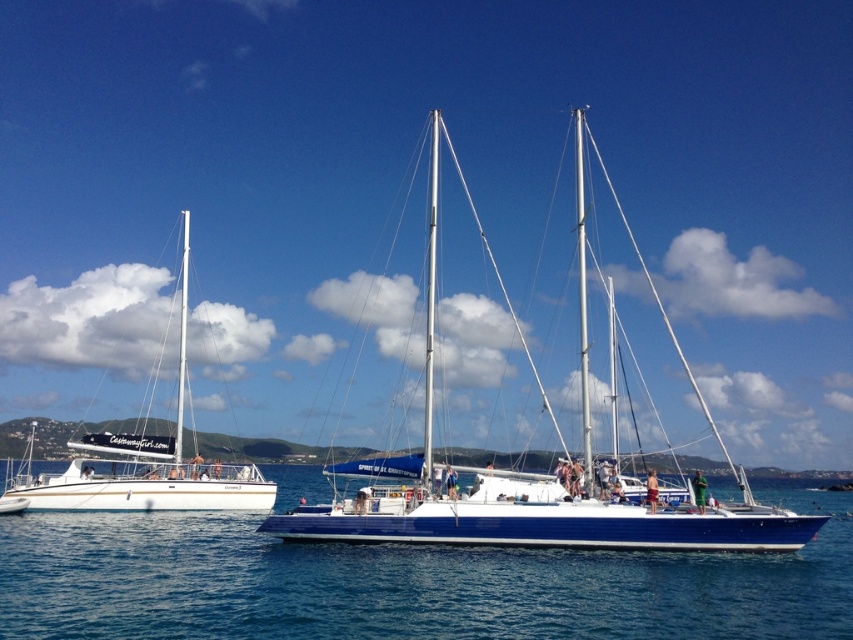
Does blue water at center have a lesser width compared to blue glossy sailboat at center?

In fact, blue water at center might be wider than blue glossy sailboat at center.

The image size is (853, 640). What do you see at coordinates (405, 582) in the screenshot?
I see `blue water at center` at bounding box center [405, 582].

Does point (369, 589) come closer to viewer compared to point (479, 544)?

Yes, it is.

What are the coordinates of `blue water at center` in the screenshot? It's located at (405, 582).

Is blue glossy sailboat at center smaller than white glossy sailboat at left?

Incorrect, blue glossy sailboat at center is not smaller in size than white glossy sailboat at left.

Does blue glossy sailboat at center have a lesser height compared to white glossy sailboat at left?

In fact, blue glossy sailboat at center may be taller than white glossy sailboat at left.

Is point (434, 120) positioned in front of point (151, 436)?

Yes, it is.

Where is `blue glossy sailboat at center`? The image size is (853, 640). blue glossy sailboat at center is located at coordinates (532, 493).

Between blue water at center and white glossy sailboat at left, which one appears on the left side from the viewer's perspective?

From the viewer's perspective, white glossy sailboat at left appears more on the left side.

Does blue water at center appear on the left side of white glossy sailboat at left?

No, blue water at center is not to the left of white glossy sailboat at left.

Who is more distant from viewer, (x=621, y=595) or (x=186, y=492)?

The point (x=186, y=492) is behind.

Image resolution: width=853 pixels, height=640 pixels. Identify the location of blue water at center. (405, 582).